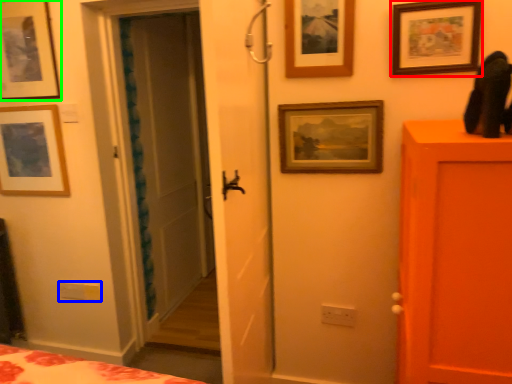
Question: Which object is positioned farthest from picture frame (highlighted by a red box)? Select from light switch (highlighted by a blue box) and picture frame (highlighted by a green box).

Choices:
 (A) light switch
 (B) picture frame

Answer: (A)